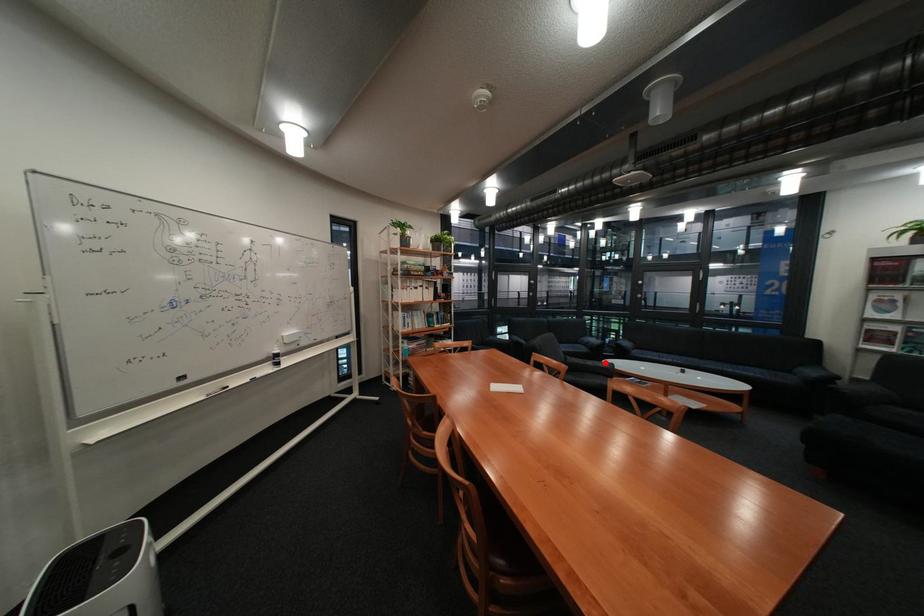
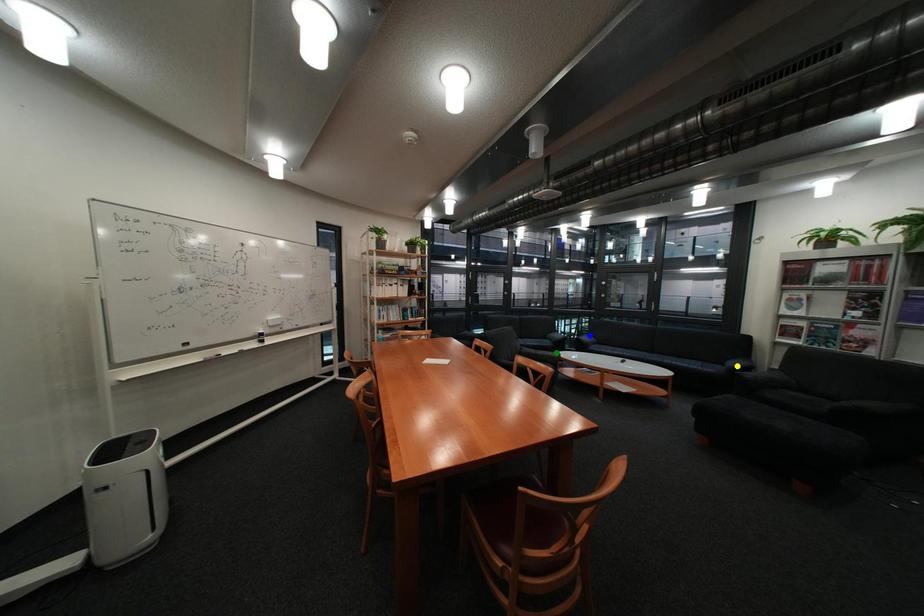
Question: I am providing you with two images of the same scene from different viewpoints. A red point is marked on the first image. You are given multiple points on the second image. Which spot in image 2 lines up with the point in image 1?

Choices:
 (A) yellow point
 (B) blue point
 (C) green point

Answer: (C)